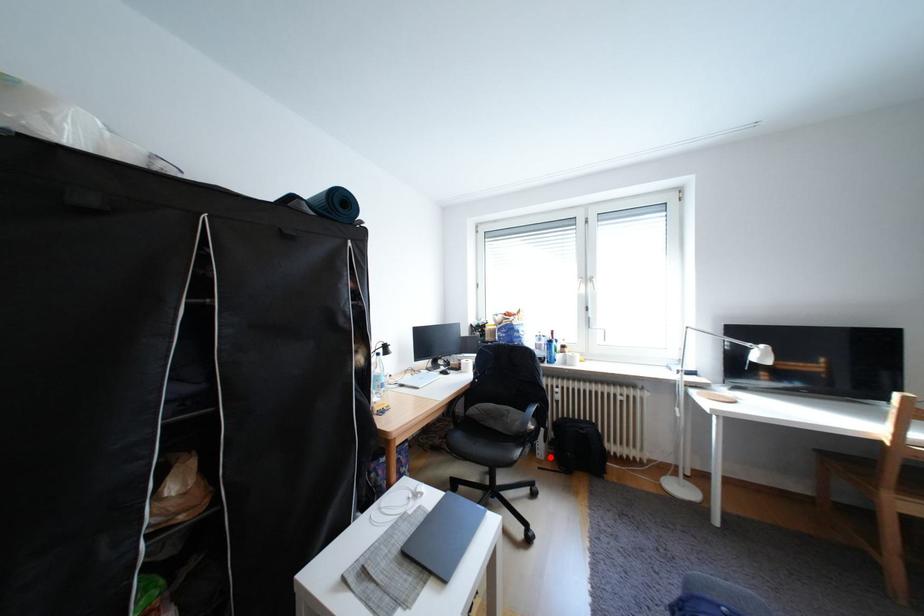
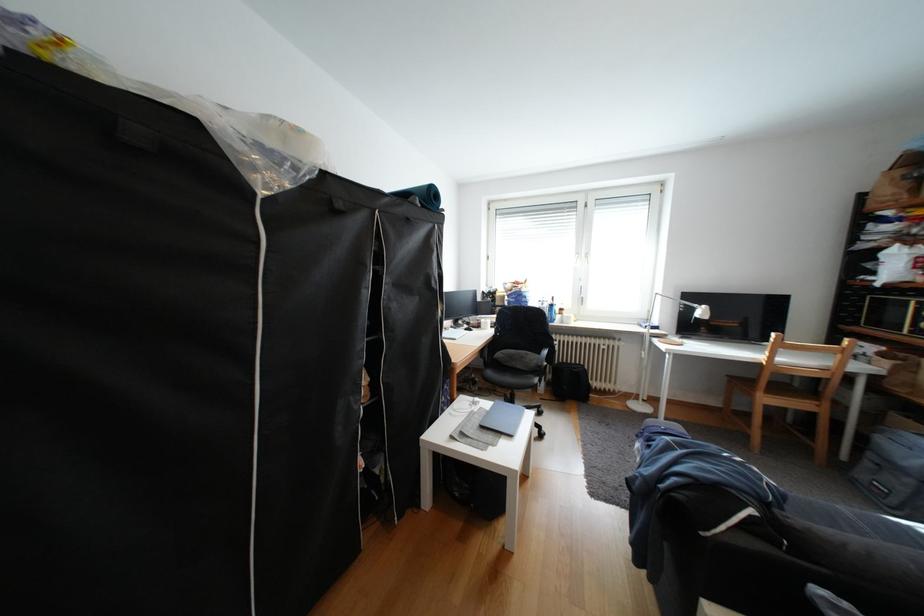
Find the pixel in the second image that matches the highlighted location in the first image.

(552, 392)